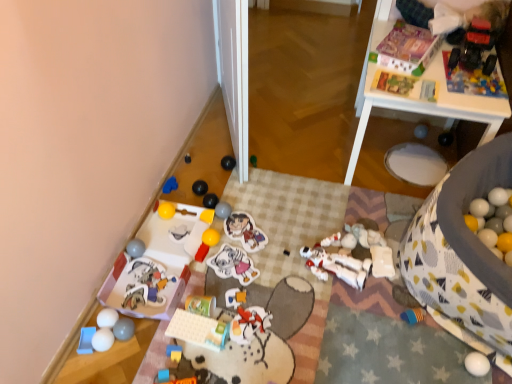
Where is `free spot to the left of smooth plastic balls at lower left, marked as the 4th toy in a left-to-right arrangement`? This screenshot has width=512, height=384. free spot to the left of smooth plastic balls at lower left, marked as the 4th toy in a left-to-right arrangement is located at coordinates (80, 342).